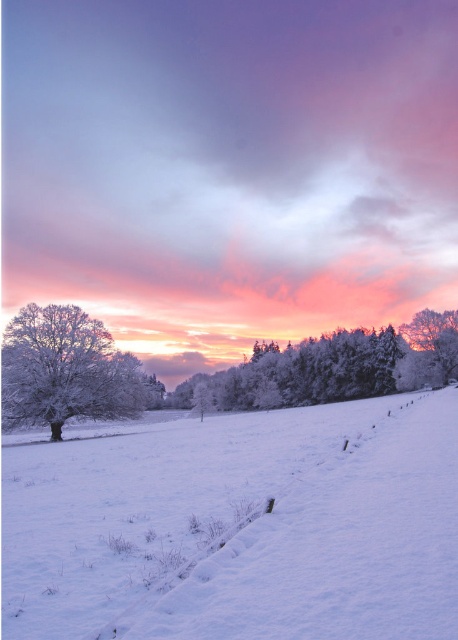
You are an artist trying to paint the winter scene. You notice the white frosty snow at center and the frosted glass trees at center. Which object in the scene has a greater thickness?

The frosted glass trees at center are thicker than the white frosty snow at center, so the frosted glass trees at center has a greater thickness.

You are an artist planning to paint this winter scene. You want to ensure the frosted glass trees at center and the white frosty tree at left are proportionally accurate. Which tree should you paint larger?

The frosted glass trees at center should be painted larger since they are larger in size than the white frosty tree at left according to the description.

You are an artist planning to paint the winter landscape. You want to ensure the frosted glass trees at center and the white frosty tree at left are arranged correctly according to their positions in the image. Which tree should be placed lower in your painting?

The frosted glass trees at center should be placed lower in the painting because they are positioned under the white frosty tree at left.